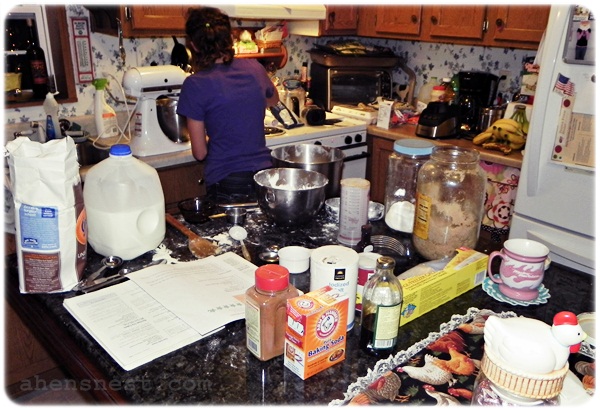
Where is `fridge`? This screenshot has width=600, height=410. fridge is located at coordinates (552, 200).